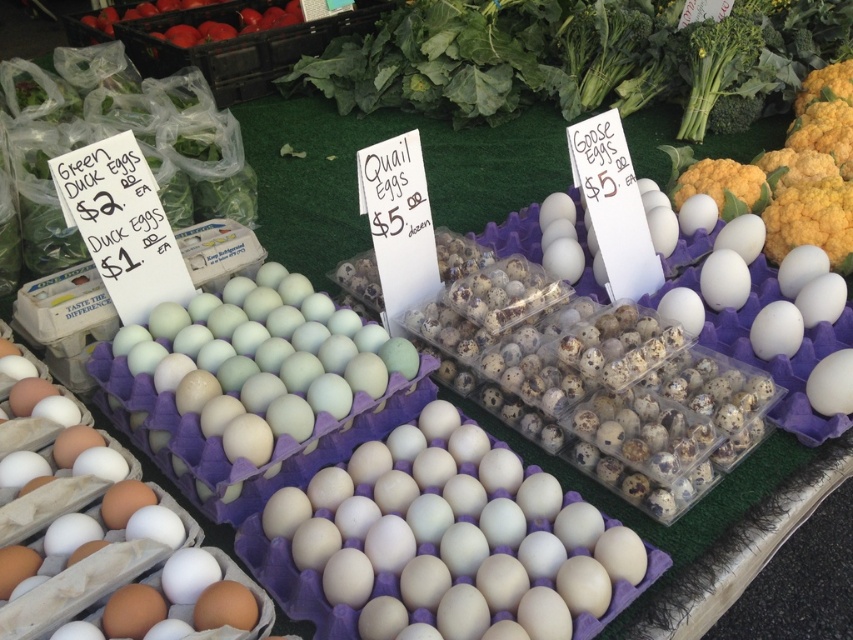
Question: Does light blue matte egg at center appear on the right side of red matte tomatoes at upper left?

Choices:
 (A) no
 (B) yes

Answer: (B)

Question: Estimate the real-world distances between objects in this image. Which object is closer to the white matte eggs at center?

Choices:
 (A) red matte tomatoes at upper left
 (B) light blue matte egg at center
 (C) white matte egg at center

Answer: (B)

Question: Estimate the real-world distances between objects in this image. Which object is closer to the light blue matte egg at center?

Choices:
 (A) white matte eggs at center
 (B) red matte tomatoes at upper left

Answer: (A)

Question: Can you confirm if red matte tomatoes at upper left is thinner than white matte egg at center?

Choices:
 (A) no
 (B) yes

Answer: (A)

Question: Which point is closer to the camera?

Choices:
 (A) red matte tomatoes at upper left
 (B) white matte egg at center
 (C) white matte eggs at center
 (D) light blue matte egg at center

Answer: (C)

Question: Does light blue matte egg at center have a smaller size compared to red matte tomatoes at upper left?

Choices:
 (A) yes
 (B) no

Answer: (A)